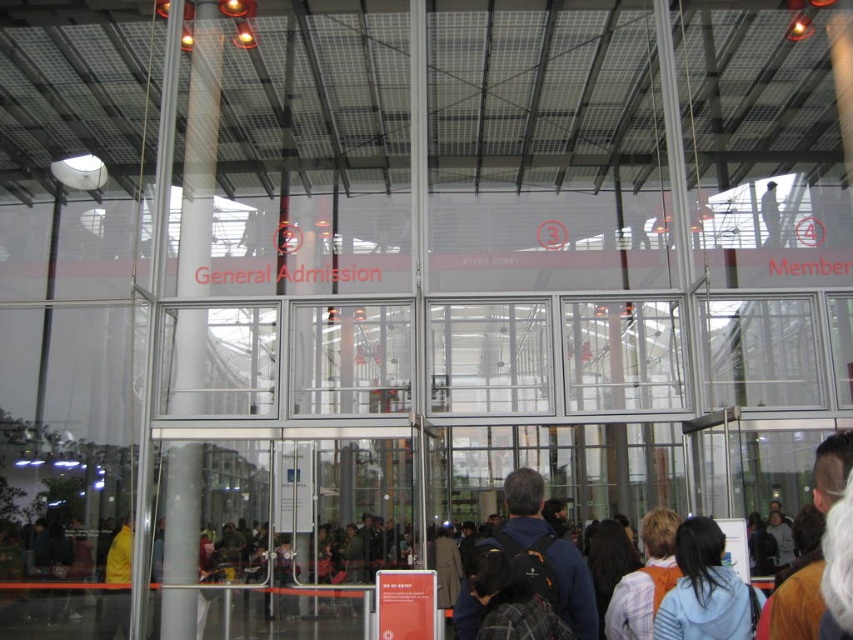
Between dark blue backpack at center and light blue hoodie at lower right, which one has less height?

light blue hoodie at lower right

Is point (543, 554) positioned behind point (724, 538)?

Yes.

Who is more distant from viewer, (532, 538) or (691, 609)?

The point (532, 538) is behind.

Identify the location of dark blue backpack at center. The width and height of the screenshot is (853, 640). (544, 554).

Who is positioned more to the left, clear glass pillar at left or light blue hoodie at lower right?

clear glass pillar at left is more to the left.

Does clear glass pillar at left appear under light blue hoodie at lower right?

No, clear glass pillar at left is not below light blue hoodie at lower right.

At what (x,y) coordinates should I click in order to perform the action: click on clear glass pillar at left. Please return your answer as a coordinate pair (x, y). This screenshot has width=853, height=640. Looking at the image, I should click on tap(199, 152).

Between clear glass pillar at left and dark blue backpack at center, which one is positioned lower?

dark blue backpack at center is lower down.

Which is behind, point (210, 100) or point (537, 552)?

Point (210, 100)

This screenshot has height=640, width=853. In order to click on clear glass pillar at left in this screenshot , I will do `click(199, 152)`.